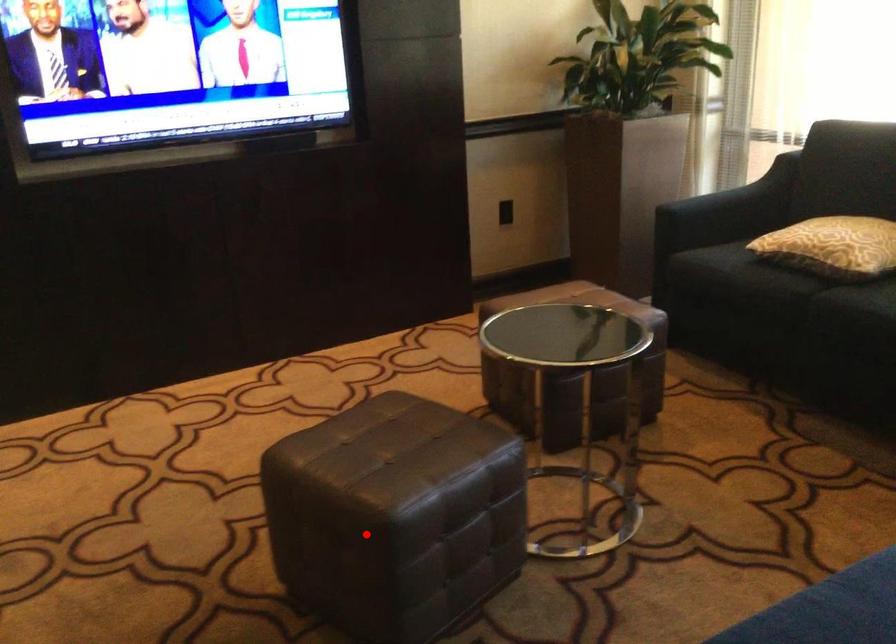
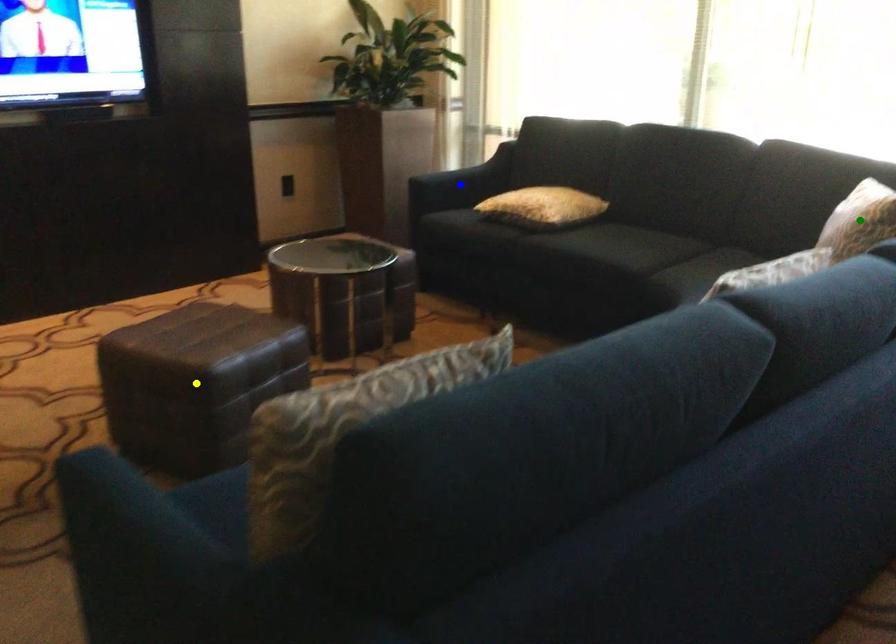
Question: I am providing you with two images of the same scene from different viewpoints. A red point is marked on the first image. You are given multiple points on the second image. Which point in image 2 is actually the same real-world point as the red point in image 1?

Choices:
 (A) blue point
 (B) yellow point
 (C) green point

Answer: (B)